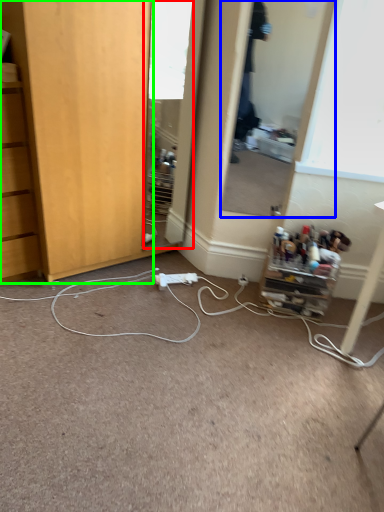
Question: Which is nearer to the mirror (highlighted by a red box)? mirror (highlighted by a blue box) or cabinetry (highlighted by a green box).

Choices:
 (A) mirror
 (B) cabinetry

Answer: (A)